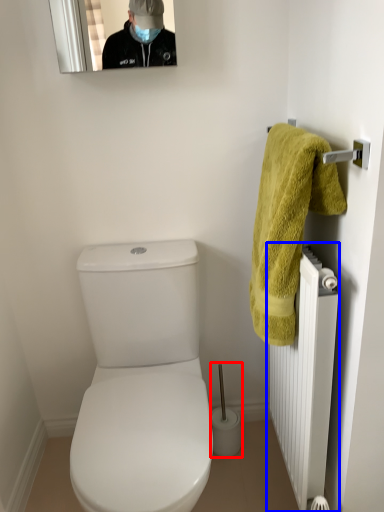
Question: Which object appears closest to the camera in this image, brush (highlighted by a red box) or radiator (highlighted by a blue box)?

Choices:
 (A) brush
 (B) radiator

Answer: (B)